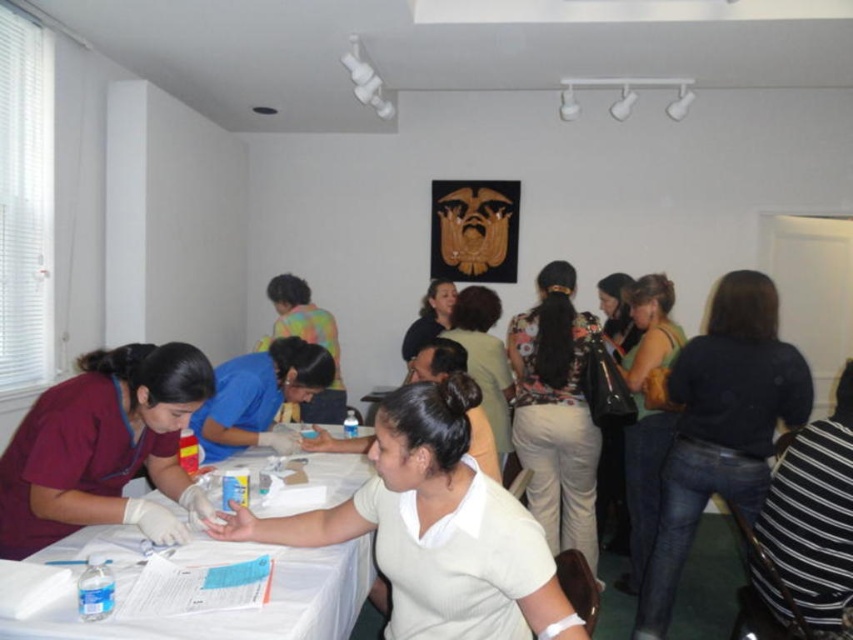
Can you confirm if maroon scrubs at left is wider than light beige sweater at center?

Yes.

Is point (151, 413) farther from viewer compared to point (488, 355)?

No.

Which is behind, point (22, 524) or point (448, 332)?

The point (448, 332) is more distant.

You are a GUI agent. You are given a task and a screenshot of the screen. Output one action in this format:
    pyautogui.click(x=<x>, y=<y>)
    Task: Click on the maroon scrubs at left
    This screenshot has width=853, height=640.
    Given the screenshot: What is the action you would take?
    pyautogui.click(x=100, y=445)

This screenshot has width=853, height=640. What do you see at coordinates (721, 426) in the screenshot?
I see `dark blue sweater at center` at bounding box center [721, 426].

Is dark blue sweater at center in front of white paper table at center?

No, it is not.

The width and height of the screenshot is (853, 640). I want to click on dark blue sweater at center, so click(721, 426).

Where is `dark blue sweater at center`? dark blue sweater at center is located at coordinates coord(721,426).

From the picture: Does maroon scrubs at left have a lesser height compared to matte black shirt at center?

In fact, maroon scrubs at left may be taller than matte black shirt at center.

Measure the distance from maroon scrubs at left to matte black shirt at center.

They are 8.16 feet apart.

Describe the element at coordinates (100, 445) in the screenshot. The width and height of the screenshot is (853, 640). I see `maroon scrubs at left` at that location.

This screenshot has width=853, height=640. In order to click on maroon scrubs at left in this screenshot , I will do `click(100, 445)`.